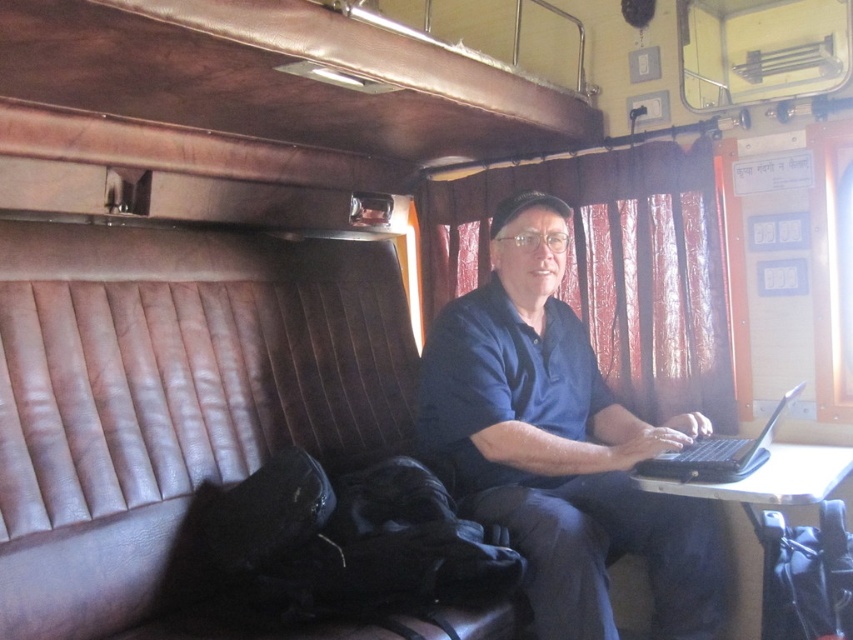
Can you confirm if brown leather couch at center is wider than black plastic laptop at center?

Yes, brown leather couch at center is wider than black plastic laptop at center.

Can you confirm if brown leather couch at center is thinner than black plastic laptop at center?

No, brown leather couch at center is not thinner than black plastic laptop at center.

From the picture: Measure the distance between brown leather couch at center and camera.

brown leather couch at center is 1.45 meters away from camera.

At what (x,y) coordinates should I click in order to perform the action: click on brown leather couch at center. Please return your answer as a coordinate pair (x, y). This screenshot has height=640, width=853. Looking at the image, I should click on pyautogui.click(x=173, y=404).

Between blue fabric shirt at center and black plastic laptop at center, which one is positioned lower?

black plastic laptop at center is lower down.

How distant is blue fabric shirt at center from black plastic laptop at center?

They are 33.77 centimeters apart.

Does point (548, 243) lie behind point (770, 435)?

Yes.

The width and height of the screenshot is (853, 640). Identify the location of blue fabric shirt at center. (560, 444).

Is brown leather couch at center above blue fabric shirt at center?

Yes, brown leather couch at center is above blue fabric shirt at center.

Which is above, brown leather couch at center or blue fabric shirt at center?

brown leather couch at center

This screenshot has width=853, height=640. In order to click on brown leather couch at center in this screenshot , I will do `click(173, 404)`.